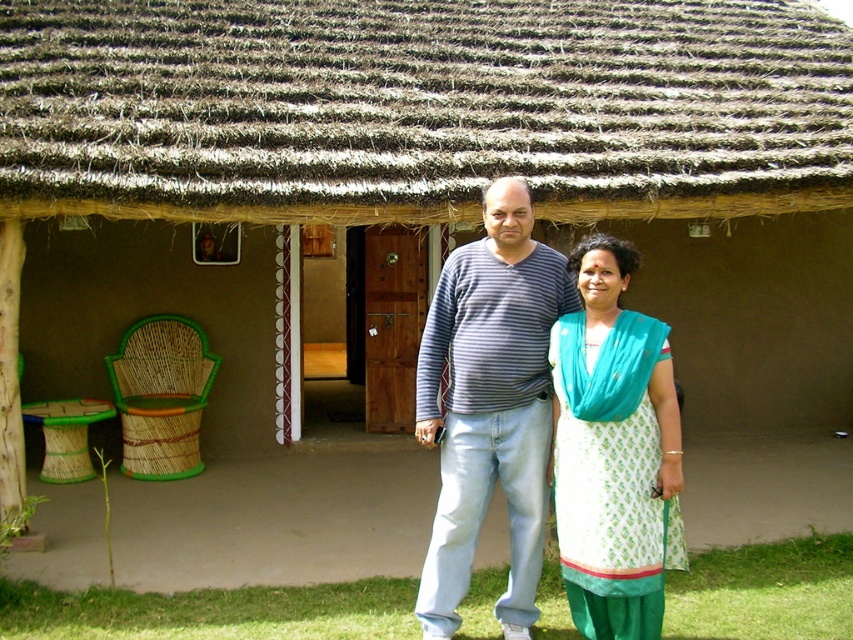
Question: Does striped cotton shirt at center have a larger size compared to white printed cotton dress at center?

Choices:
 (A) yes
 (B) no

Answer: (A)

Question: Which point appears farthest from the camera in this image?

Choices:
 (A) (538, 362)
 (B) (506, 156)

Answer: (B)

Question: Which object is the farthest from the striped cotton shirt at center?

Choices:
 (A) white printed cotton dress at center
 (B) brown thatch at upper center

Answer: (B)

Question: Which object is farther from the camera taking this photo?

Choices:
 (A) brown thatch at upper center
 (B) striped cotton shirt at center
 (C) white printed cotton dress at center

Answer: (A)

Question: Is brown thatch at upper center below white printed cotton dress at center?

Choices:
 (A) yes
 (B) no

Answer: (B)

Question: Is brown thatch at upper center in front of white printed cotton dress at center?

Choices:
 (A) no
 (B) yes

Answer: (A)